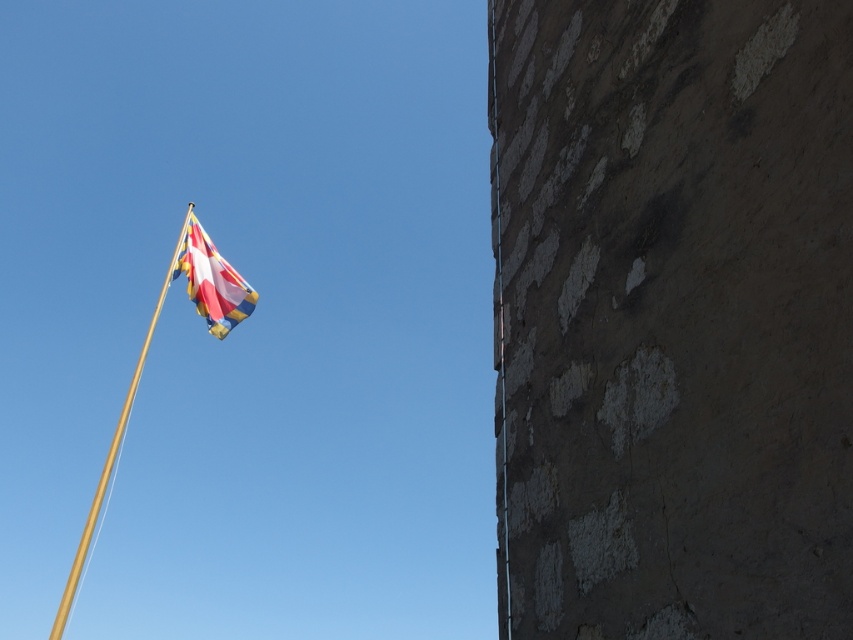
Question: Which point is closer to the camera?

Choices:
 (A) (x=625, y=131)
 (B) (x=114, y=433)
 (C) (x=221, y=304)

Answer: (A)

Question: Is stone textured wall at right positioned at the back of multi-colored fabric flag at upper left?

Choices:
 (A) yes
 (B) no

Answer: (B)

Question: Which of the following is the closest to the observer?

Choices:
 (A) stone textured wall at right
 (B) gold polished pole at upper left
 (C) multi-colored fabric flag at upper left

Answer: (A)

Question: Does stone textured wall at right have a greater width compared to gold polished pole at upper left?

Choices:
 (A) no
 (B) yes

Answer: (A)

Question: Considering the relative positions of stone textured wall at right and multi-colored fabric flag at upper left in the image provided, where is stone textured wall at right located with respect to multi-colored fabric flag at upper left?

Choices:
 (A) right
 (B) left

Answer: (A)

Question: Among these objects, which one is nearest to the camera?

Choices:
 (A) stone textured wall at right
 (B) gold polished pole at upper left

Answer: (A)